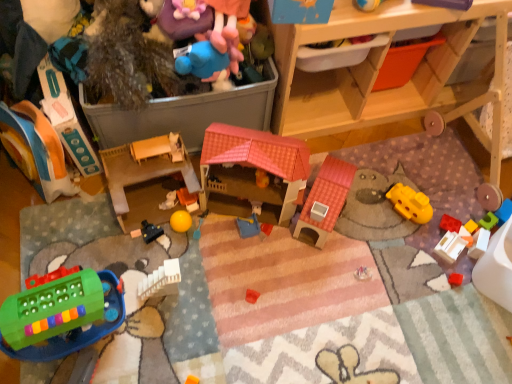
I want to click on free location in front of smooth orange ball at center, positioned as the 7th toy in left-to-right order, so click(x=178, y=250).